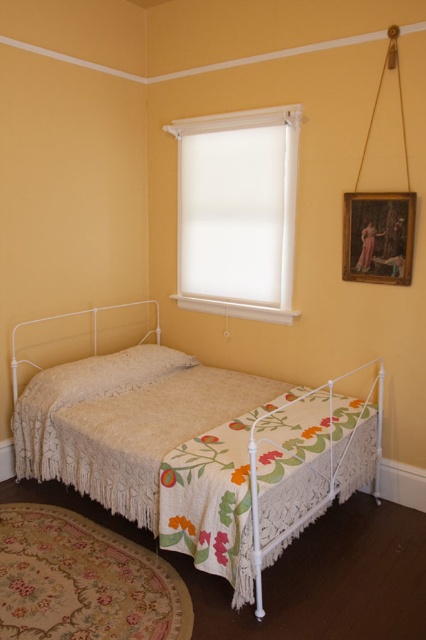
Question: Among these points, which one is nearest to the camera?

Choices:
 (A) (342, 419)
 (B) (227, 237)

Answer: (A)

Question: Which object is the closest to the wooden framed painting at upper right?

Choices:
 (A) white matte window at upper center
 (B) white lace bed at center

Answer: (A)

Question: Which is nearer to the white matte window at upper center?

Choices:
 (A) white lace bed at center
 (B) wooden framed painting at upper right

Answer: (B)

Question: Can you confirm if white lace bed at center is positioned above white matte window at upper center?

Choices:
 (A) yes
 (B) no

Answer: (B)

Question: Is white lace bed at center below wooden framed painting at upper right?

Choices:
 (A) no
 (B) yes

Answer: (B)

Question: Is white lace bed at center closer to camera compared to white matte window at upper center?

Choices:
 (A) no
 (B) yes

Answer: (B)